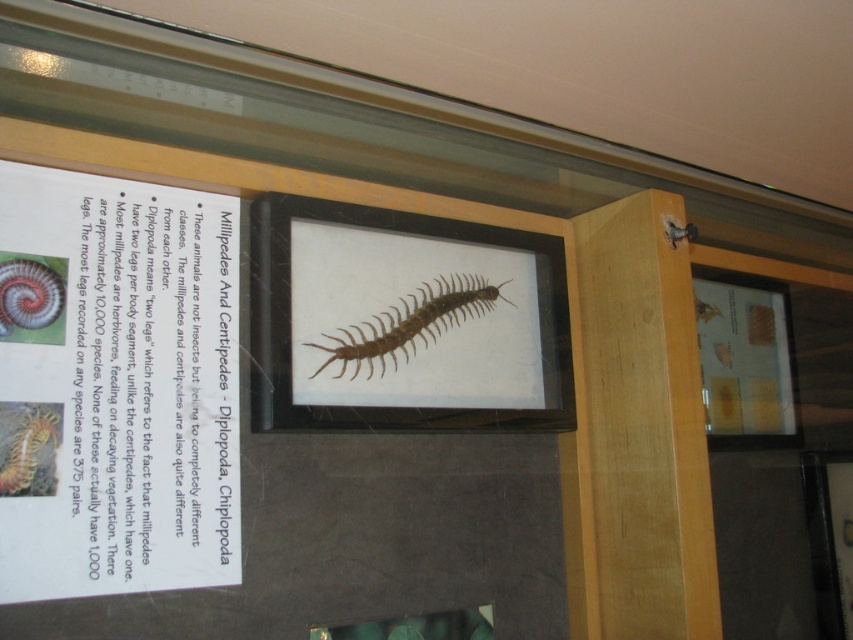
Question: Which object is farther from the camera taking this photo?

Choices:
 (A) bright orange centipede at lower left
 (B) white paper at upper left

Answer: (A)

Question: Which object is the farthest from the brown matte centipede at center?

Choices:
 (A) bright orange centipede at lower left
 (B) shiny metallic spiral at left

Answer: (A)

Question: Does bright orange centipede at lower left have a larger size compared to shiny metallic spiral at left?

Choices:
 (A) yes
 (B) no

Answer: (A)

Question: Is brown matte centipede at center to the left of shiny metallic spiral at left from the viewer's perspective?

Choices:
 (A) yes
 (B) no

Answer: (B)

Question: Which object is positioned farthest from the bright orange centipede at lower left?

Choices:
 (A) shiny metallic spiral at left
 (B) brown matte centipede at center

Answer: (B)

Question: Can you confirm if brown matte centipede at center is bigger than shiny metallic spiral at left?

Choices:
 (A) no
 (B) yes

Answer: (B)